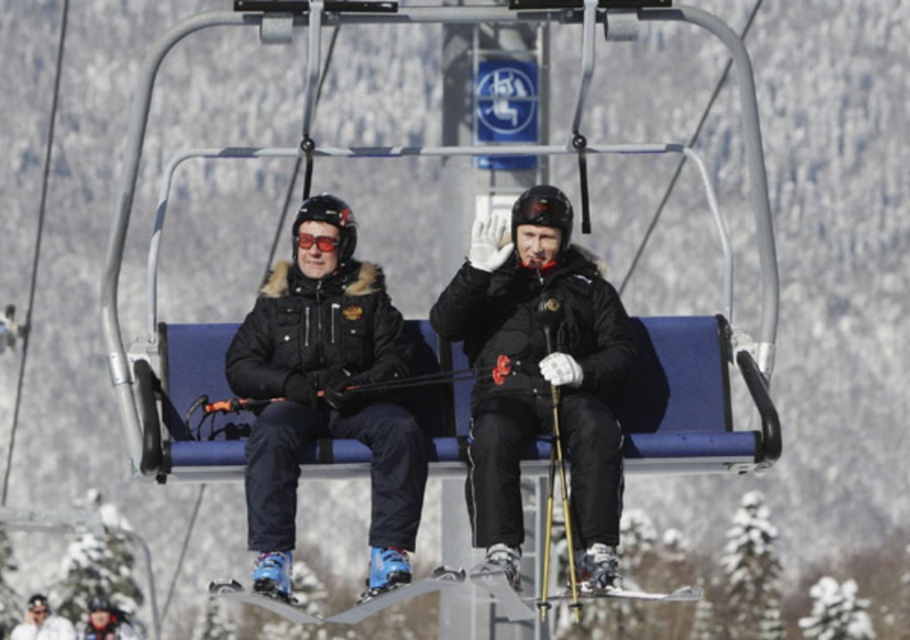
You are designing a storage rack for winter gear. The rack has a compartment that can hold two items side by side. If you want to store both the matte black jackets at center and the matte black jacket at center, will the compartment be wide enough?

The matte black jackets at center might be wider than the matte black jacket at center, so the compartment must be checked for width to ensure both can fit side by side.

You are a photographer trying to capture a clear shot of both matte black jackets at center and matte black jacket at center from your position below the ski lift. Based on their heights, which jacket will appear larger in your photo?

The matte black jackets at center has a greater height compared to matte black jacket at center, so it will appear larger in the photo.